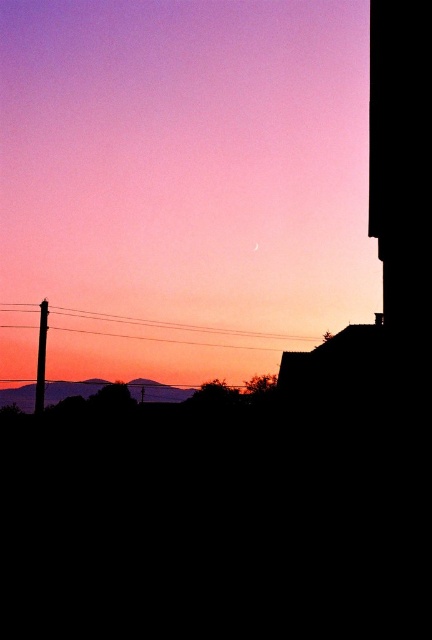
Question: Among these points, which one is nearest to the camera?

Choices:
 (A) (44, 371)
 (B) (280, 200)
 (C) (175, 401)

Answer: (A)

Question: Is silvery metallic mountains at lower center closer to the viewer compared to smooth wood telegraph pole at left?

Choices:
 (A) yes
 (B) no

Answer: (B)

Question: Can you confirm if silvery metallic crescent moon at upper center is positioned to the left of black wire at lower center?

Choices:
 (A) no
 (B) yes

Answer: (A)

Question: Can you confirm if silvery metallic crescent moon at upper center is positioned to the left of black wire at lower center?

Choices:
 (A) no
 (B) yes

Answer: (A)

Question: Which point is farther to the camera?

Choices:
 (A) (254, 376)
 (B) (45, 337)
 (C) (86, 275)

Answer: (C)

Question: Which object appears farthest from the camera in this image?

Choices:
 (A) silvery metallic crescent moon at upper center
 (B) smooth wood telegraph pole at left
 (C) silvery metallic mountains at lower center

Answer: (C)